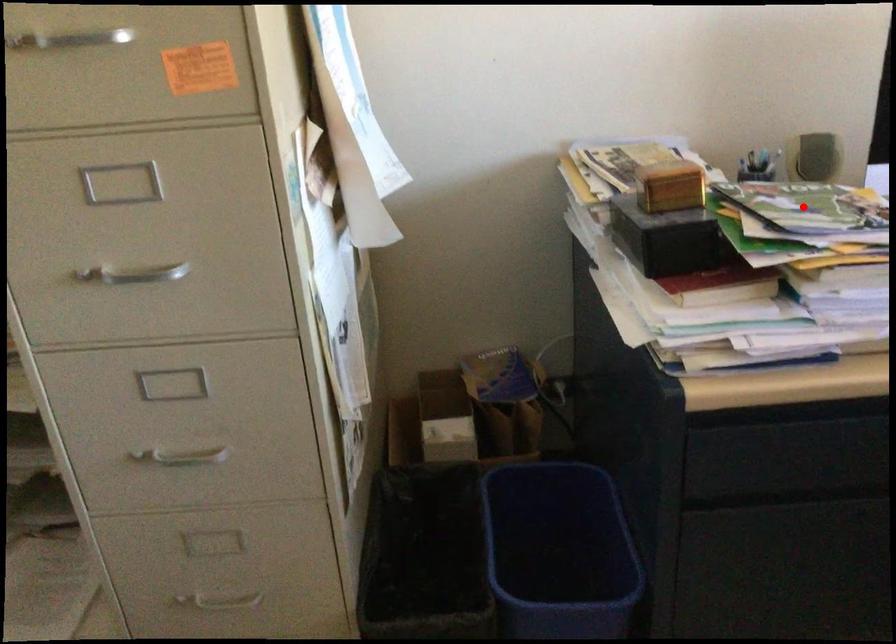
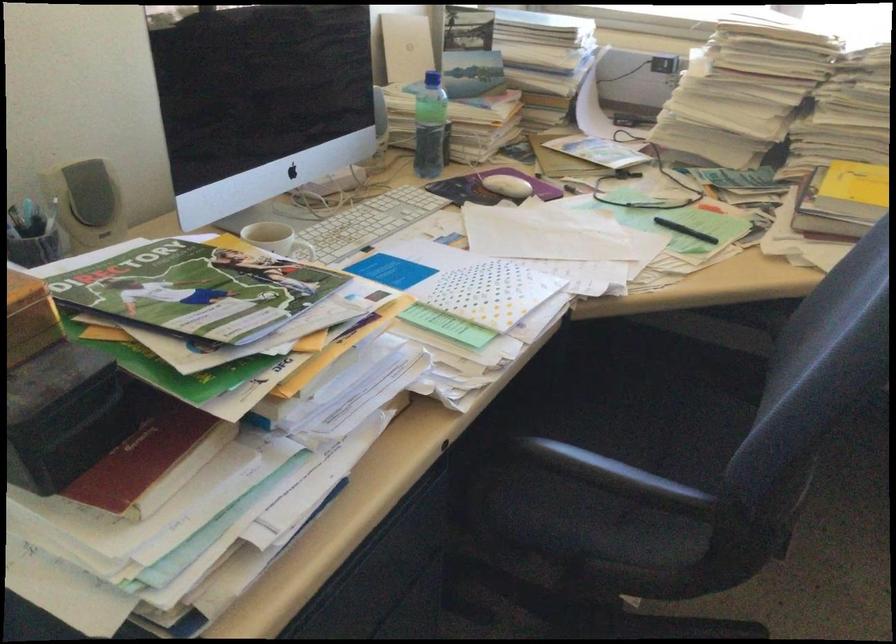
Find the pixel in the second image that matches the highlighted location in the first image.

(195, 290)